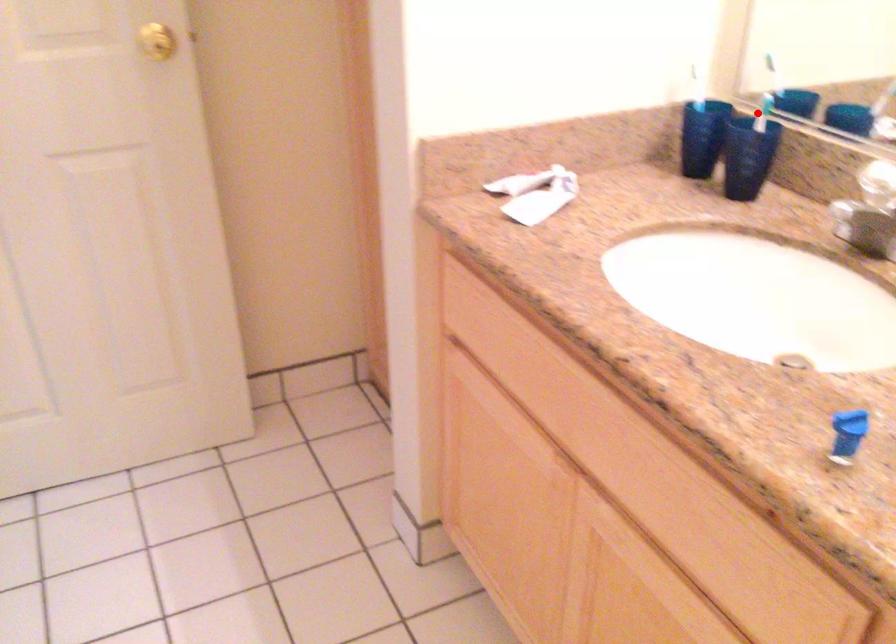
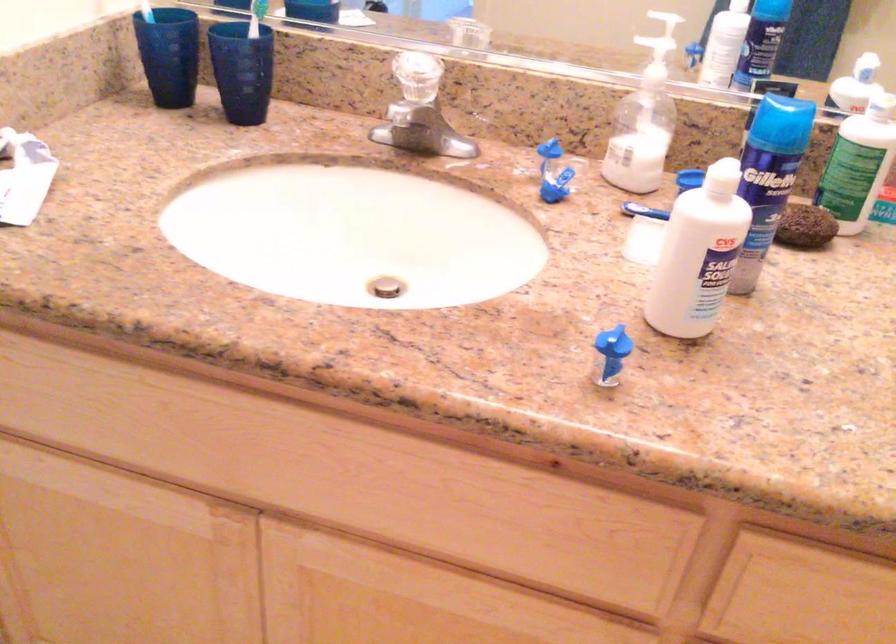
Find the pixel in the second image that matches the highlighted location in the first image.

(255, 17)